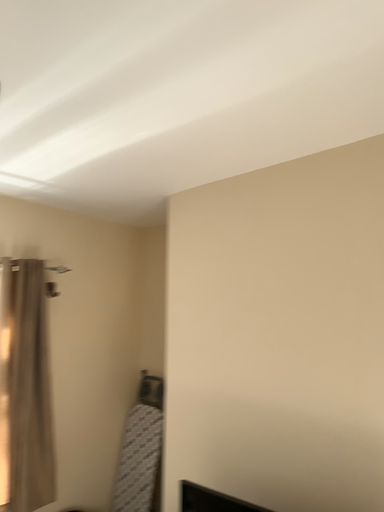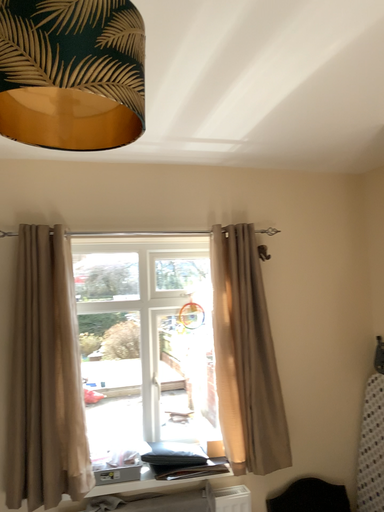
Question: Which way did the camera rotate in the video?

Choices:
 (A) rotated upward
 (B) rotated downward

Answer: (B)